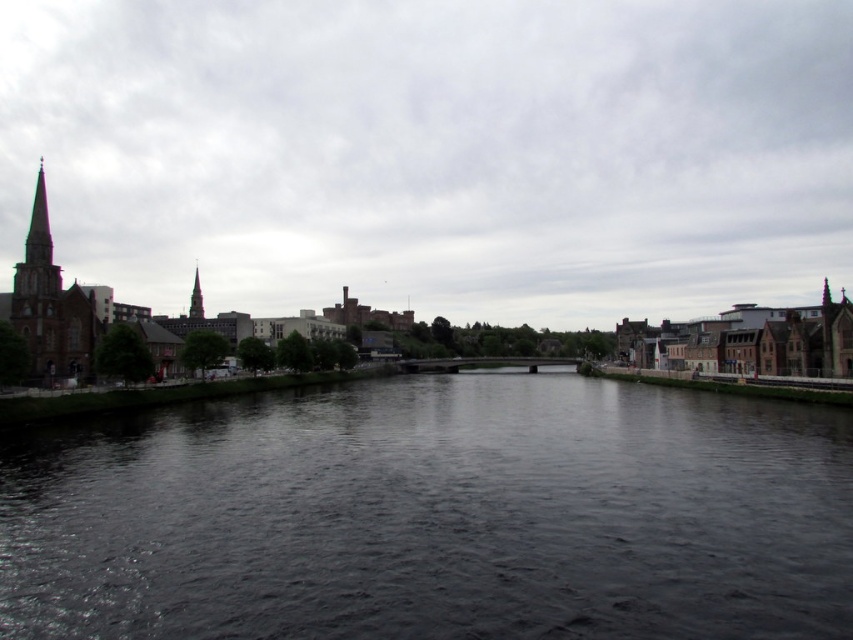
Based on the scene description, what does the point at coordinates [434,154] indicate?

The point at coordinates [434,154] marks the cloudy sky at upper center.

You are standing at the riverside and want to determine the relative positions of two points marked in the scene. Which point is closer to you, point [737,224] or point [62,461]?

Point [737,224] is further to the viewer than point [62,461], so the closer point to you is point [62,461].